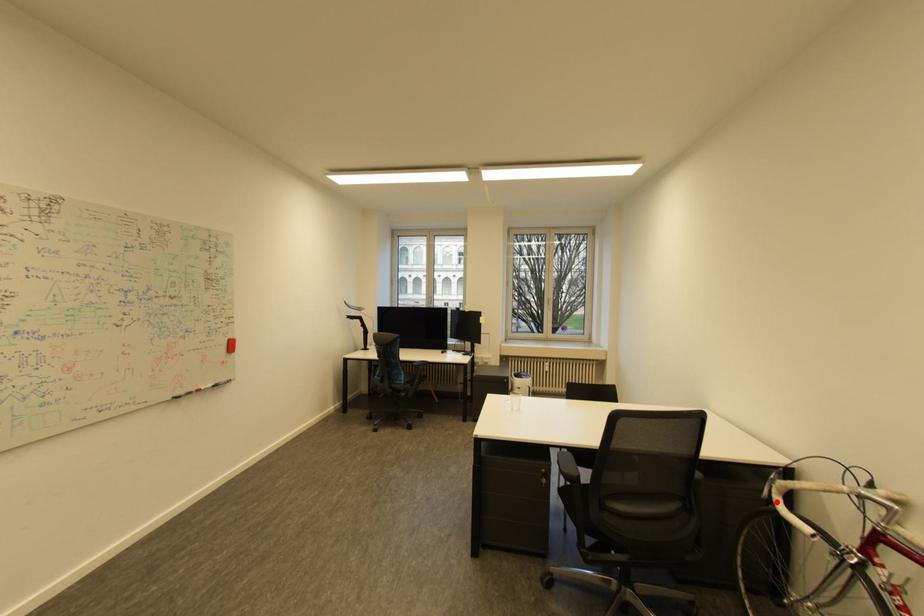
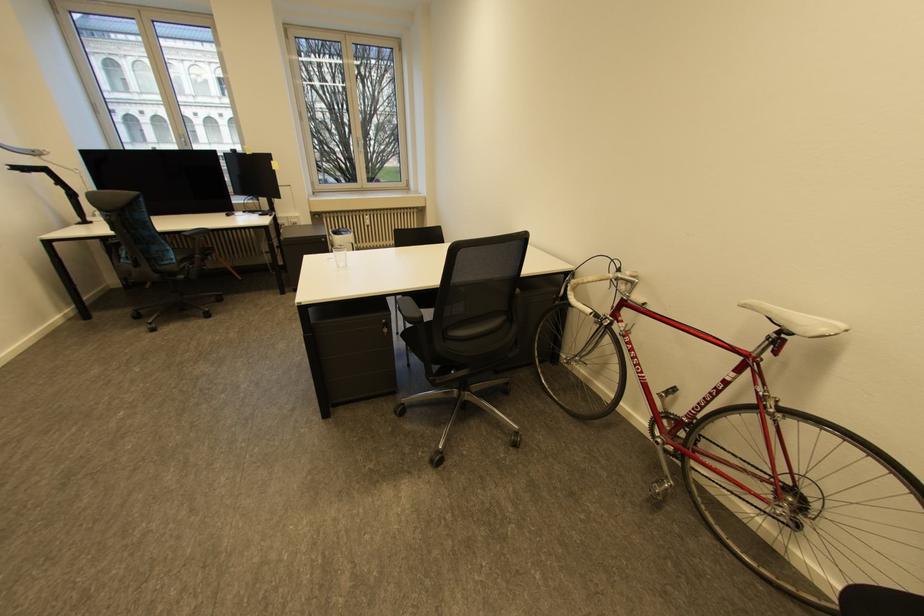
Question: I am providing you with two images of the same scene from different viewpoints. Given a red point in image1, look at the same physical point in image2. Is it:

Choices:
 (A) Closer to the viewpoint
 (B) Farther from the viewpoint

Answer: (A)